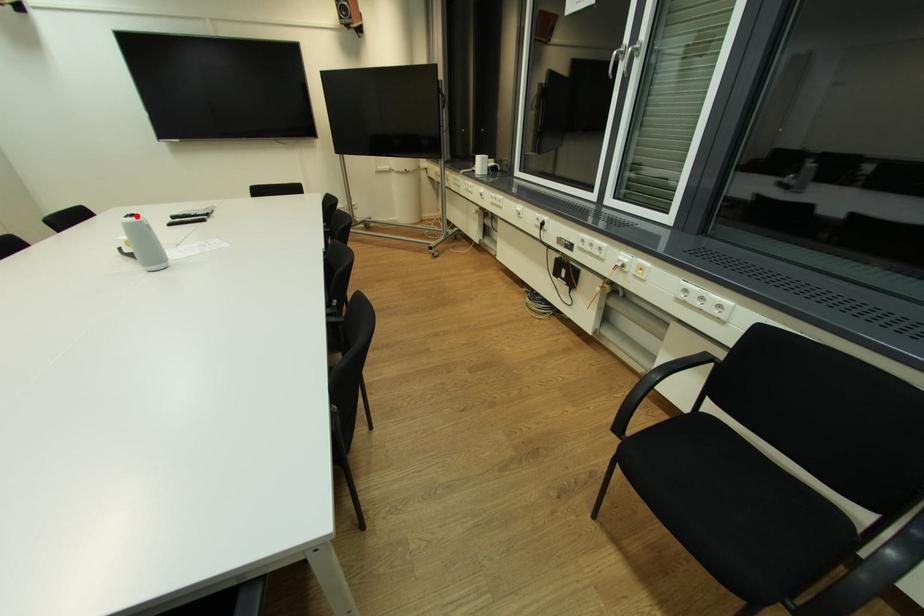
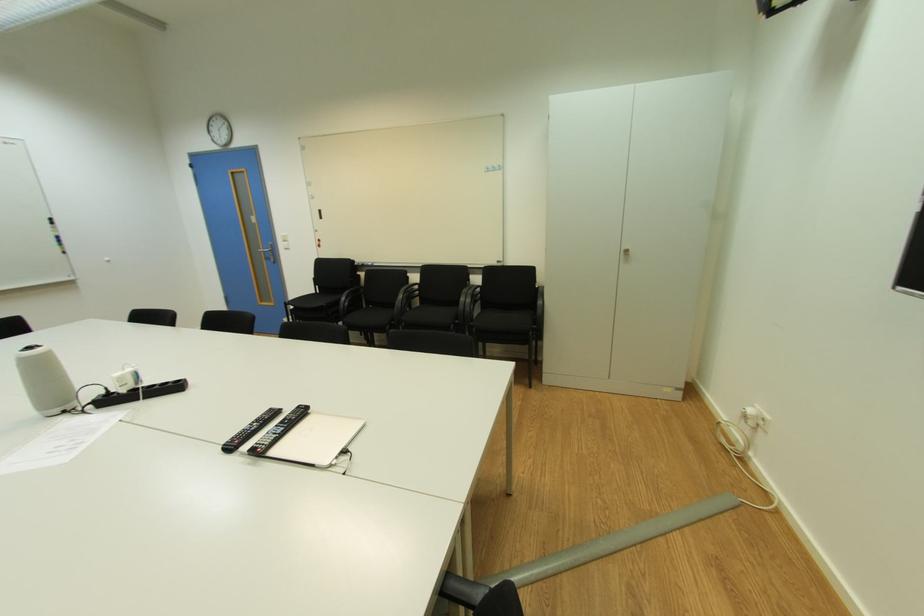
Question: A red point is marked in image1. In image2, is the corresponding 3D point closer to the camera or farther? Reply with the corresponding letter.

Choices:
 (A) The corresponding 3D point is closer.
 (B) The corresponding 3D point is farther.

Answer: (A)